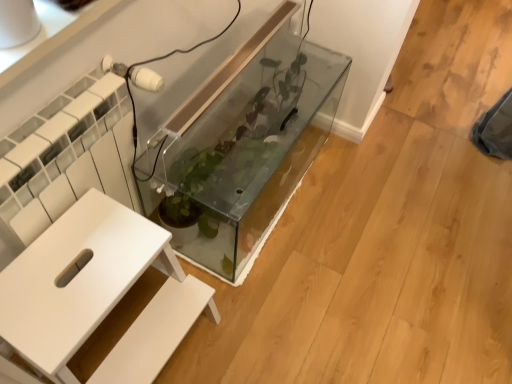
Question: Does transparent glass tank at center have a lesser width compared to white textured radiator at left?

Choices:
 (A) no
 (B) yes

Answer: (A)

Question: Can you confirm if transparent glass tank at center is taller than white textured radiator at left?

Choices:
 (A) yes
 (B) no

Answer: (B)

Question: Can you confirm if transparent glass tank at center is wider than white textured radiator at left?

Choices:
 (A) no
 (B) yes

Answer: (B)

Question: Is transparent glass tank at center positioned behind white textured radiator at left?

Choices:
 (A) yes
 (B) no

Answer: (A)

Question: Considering the relative sizes of transparent glass tank at center and white textured radiator at left in the image provided, is transparent glass tank at center shorter than white textured radiator at left?

Choices:
 (A) yes
 (B) no

Answer: (A)

Question: Are transparent glass tank at center and white textured radiator at left far apart?

Choices:
 (A) no
 (B) yes

Answer: (A)

Question: From the image's perspective, is white textured radiator at left above white matte table at center?

Choices:
 (A) no
 (B) yes

Answer: (B)

Question: Can you confirm if white textured radiator at left is shorter than white matte table at center?

Choices:
 (A) no
 (B) yes

Answer: (A)

Question: Is white textured radiator at left taller than white matte table at center?

Choices:
 (A) no
 (B) yes

Answer: (B)

Question: Does white textured radiator at left come in front of white matte table at center?

Choices:
 (A) no
 (B) yes

Answer: (A)

Question: Is white textured radiator at left next to white matte table at center and touching it?

Choices:
 (A) yes
 (B) no

Answer: (B)

Question: Is white textured radiator at left smaller than white matte table at center?

Choices:
 (A) no
 (B) yes

Answer: (B)

Question: Is transparent glass tank at center thinner than white matte table at center?

Choices:
 (A) no
 (B) yes

Answer: (B)